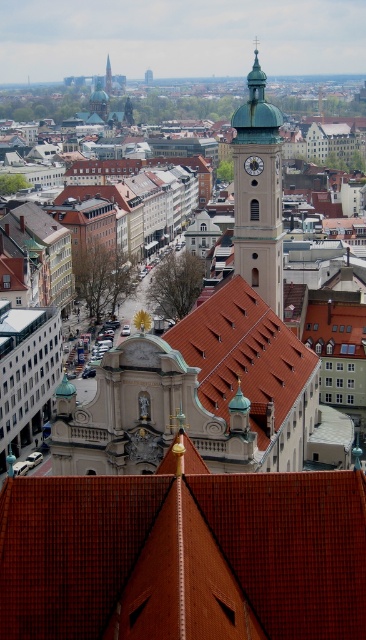
The width and height of the screenshot is (366, 640). Describe the element at coordinates (184, 554) in the screenshot. I see `brown tiled roof at center` at that location.

Who is more forward, (84, 611) or (258, 170)?

Positioned in front is point (84, 611).

I want to click on brown tiled roof at center, so click(184, 554).

Is brown tile roof at center further to the viewer compared to green glass spire at upper center?

No, it is not.

Which is behind, point (228, 417) or point (109, 84)?

Point (109, 84)

Is point (251, 324) closer to viewer compared to point (109, 77)?

Yes, point (251, 324) is in front of point (109, 77).

Locate an element on the screen. This screenshot has height=640, width=366. brown tile roof at center is located at coordinates (248, 358).

Is brown tiled roof at center smaller than brown tile roof at center?

Result: Yes.

Which of these two, brown tiled roof at center or brown tile roof at center, stands shorter?

brown tiled roof at center

Describe the element at coordinates (184, 554) in the screenshot. Image resolution: width=366 pixels, height=640 pixels. I see `brown tiled roof at center` at that location.

Locate an element on the screen. This screenshot has width=366, height=640. brown tiled roof at center is located at coordinates (184, 554).